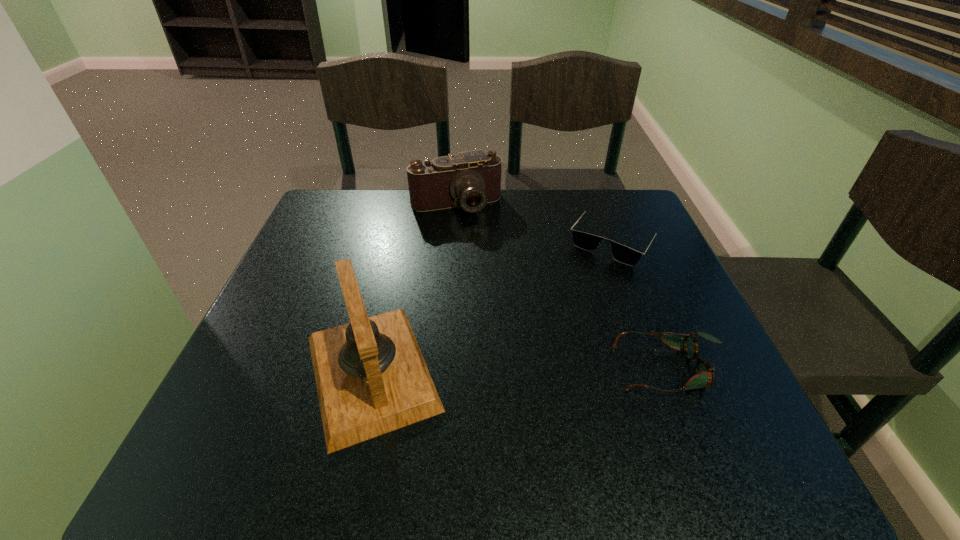
Find the location of a particular element. The image size is (960, 540). bell is located at coordinates (371, 378).

In order to click on spectacles in this screenshot , I will do `click(704, 372)`.

Identify the location of the second tallest object. The width and height of the screenshot is (960, 540). (470, 179).

Find the location of a particular element. sunglasses is located at coordinates (588, 242).

The width and height of the screenshot is (960, 540). What are the coordinates of `vacant space located 0.120m on the left of the tallest object` in the screenshot? It's located at (228, 372).

I want to click on vacant space located on the front-facing side of the spectacles, so click(400, 368).

Find the location of a particular element. This screenshot has width=960, height=540. free location located 0.290m on the front-facing side of the spectacles is located at coordinates (456, 368).

I want to click on vacant space situated on the front-facing side of the spectacles, so click(x=506, y=368).

Identify the location of vacant space located on the front-facing side of the third shortest object. This screenshot has height=540, width=960. (505, 313).

Find the location of a particular element. vacant space situated 0.280m on the front-facing side of the third shortest object is located at coordinates (496, 293).